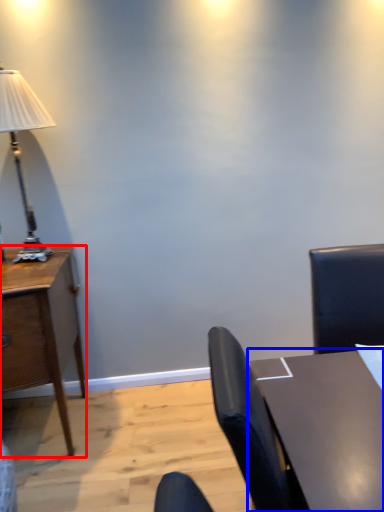
Question: Which object appears closest to the camera in this image, desk (highlighted by a red box) or table (highlighted by a blue box)?

Choices:
 (A) desk
 (B) table

Answer: (B)